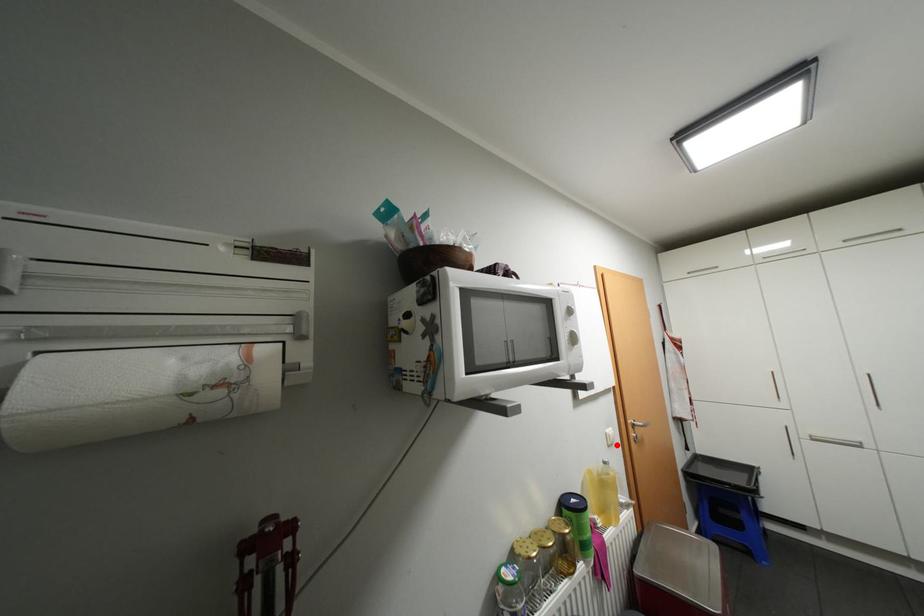
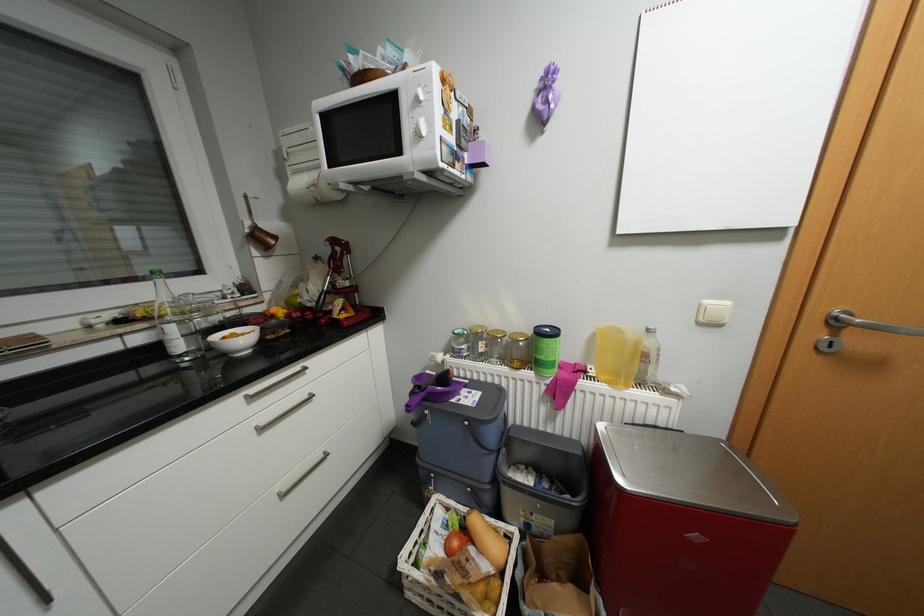
Question: I am providing you with two images of the same scene from different viewpoints. A red point is shown in image1. For the corresponding object point in image2, is it positioned nearer or farther from the camera?

Choices:
 (A) Nearer
 (B) Farther

Answer: (A)